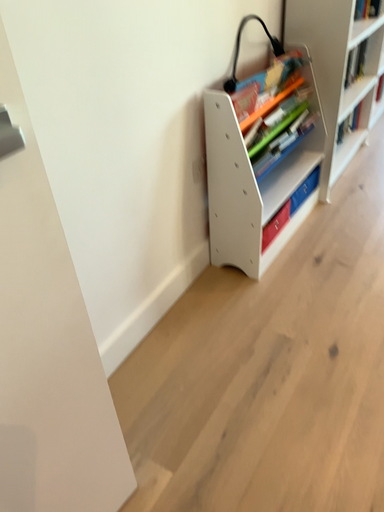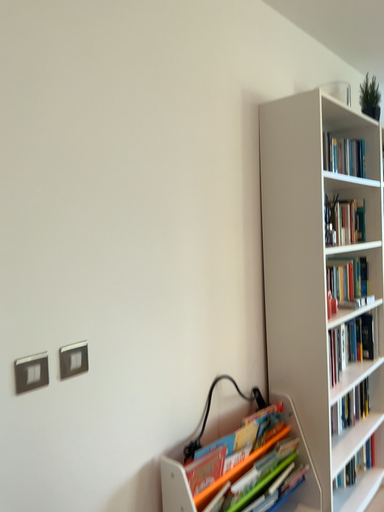
Question: Which way did the camera rotate in the video?

Choices:
 (A) rotated downward
 (B) rotated upward

Answer: (B)